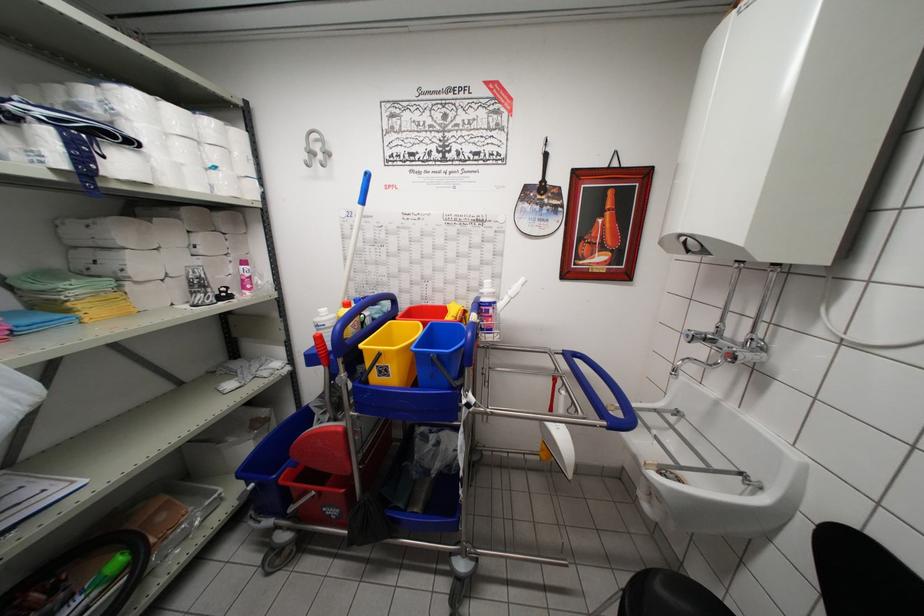
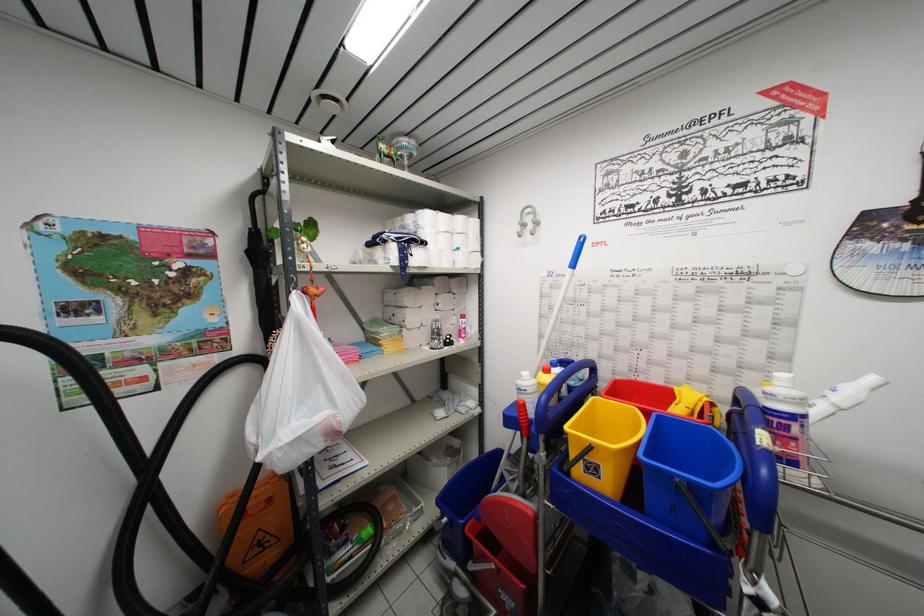
Where in the second image is the point corresponding to the point at 329,350 from the first image?

(530, 419)